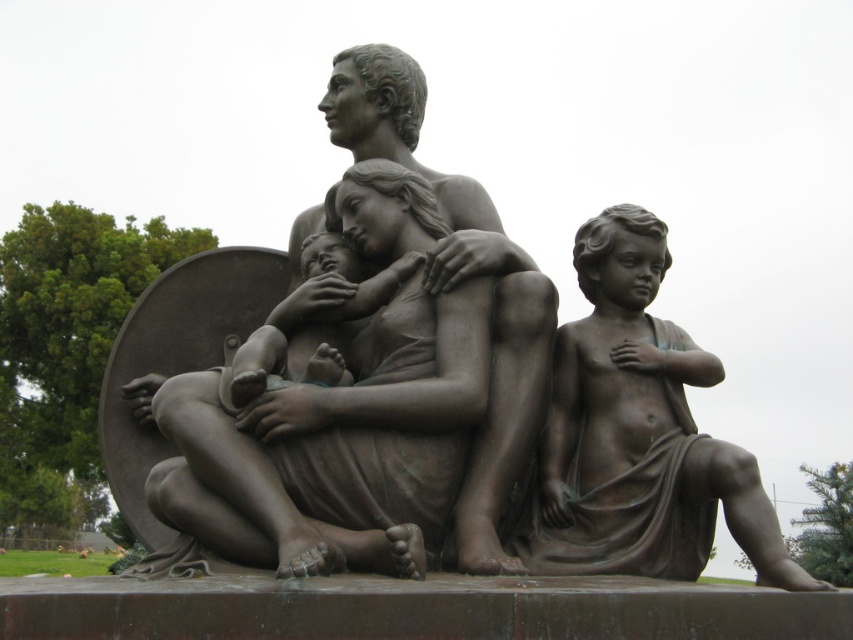
Which is behind, point (495, 272) or point (689, 566)?

The point (495, 272) is more distant.

Does bronze sculpture at center have a lesser width compared to bronze statue of child at right?

No.

Is point (381, 216) positioned before point (608, 461)?

No, (381, 216) is further to viewer.

In order to click on bronze sculpture at center in this screenshot , I will do (x=373, y=372).